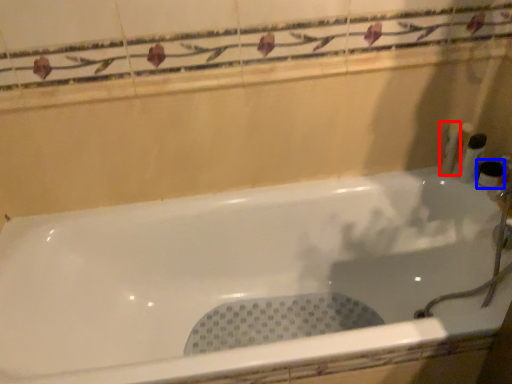
Question: Which object is further to the camera taking this photo, toiletry (highlighted by a red box) or toiletry (highlighted by a blue box)?

Choices:
 (A) toiletry
 (B) toiletry

Answer: (A)